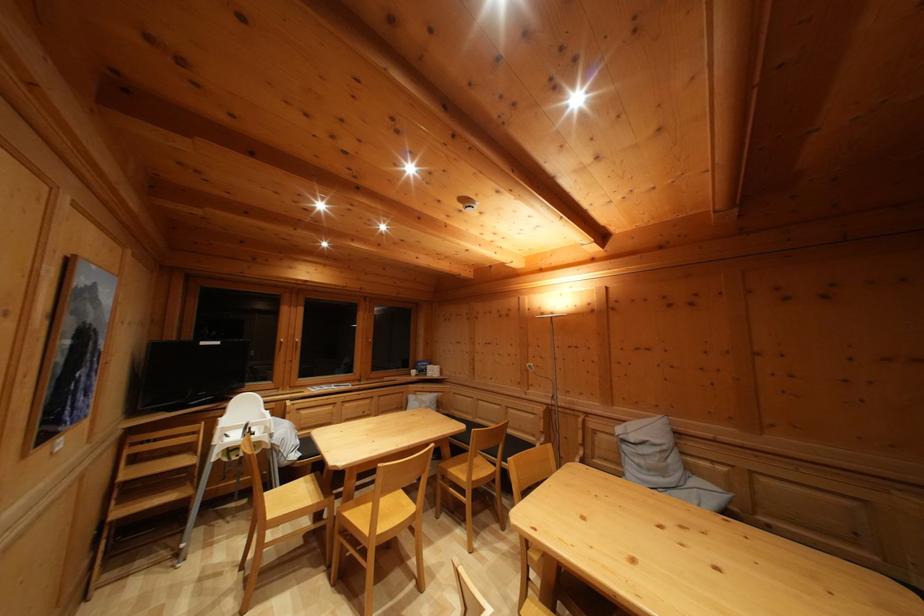
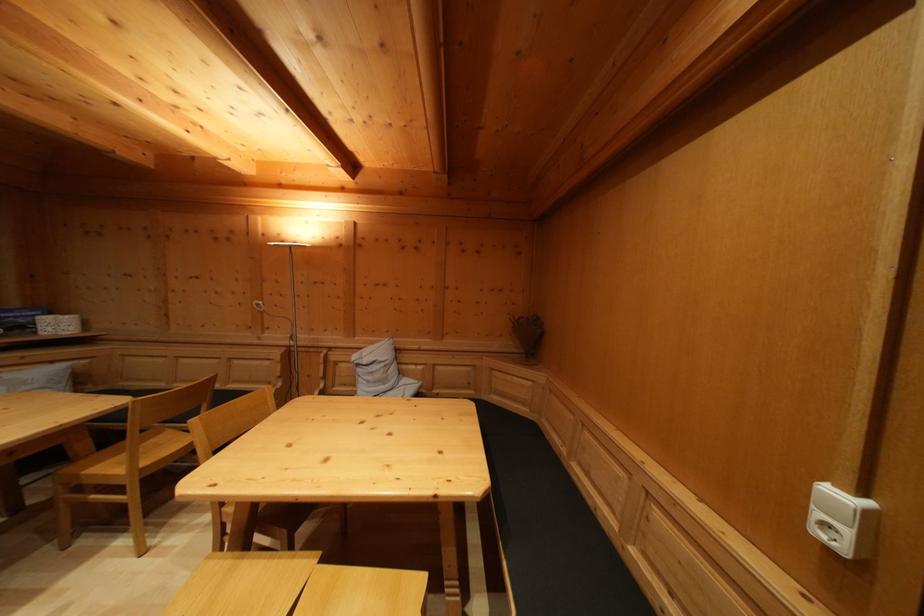
Question: Based on the continuous images, in which direction is the camera rotating? Reply with the corresponding letter.

Choices:
 (A) Left
 (B) Right
 (C) Up
 (D) Down

Answer: (B)